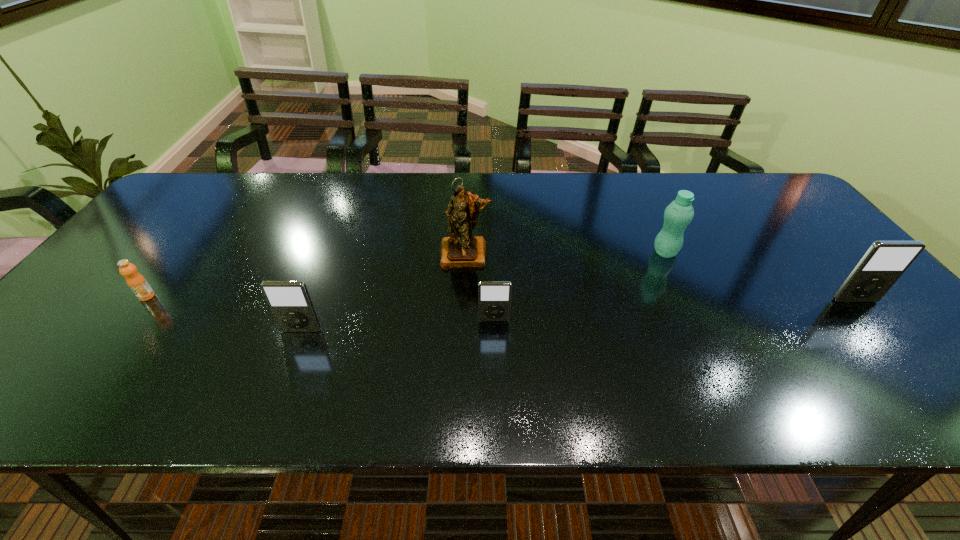
The height and width of the screenshot is (540, 960). In the image, there is a desktop. Find the location of `free space at the right edge`. free space at the right edge is located at coordinates (826, 273).

This screenshot has height=540, width=960. Find the location of `vacant area at the far right corner of the desktop`. vacant area at the far right corner of the desktop is located at coordinates (772, 199).

Image resolution: width=960 pixels, height=540 pixels. I want to click on empty space between the rightmost object and the fourth tallest object, so click(x=578, y=315).

The width and height of the screenshot is (960, 540). I want to click on empty space that is in between the nearest object and the rightmost iPod, so click(x=578, y=315).

Locate an element on the screen. Image resolution: width=960 pixels, height=540 pixels. empty location between the fifth object from right to left and the orange juice is located at coordinates (224, 314).

I want to click on vacant space in between the third shortest object and the rightmost iPod, so click(x=578, y=315).

Locate an element on the screen. free space between the shortest iPod and the second tallest iPod is located at coordinates (397, 325).

This screenshot has width=960, height=540. What are the coordinates of `empty space that is in between the second farthest iPod and the nearest object` in the screenshot? It's located at (397, 325).

You are a GUI agent. You are given a task and a screenshot of the screen. Output one action in this format:
    pyautogui.click(x=<x>, y=<y>)
    Task: Click on the empty space between the fourth tallest object and the tallest iPod
    
    Given the screenshot: What is the action you would take?
    pyautogui.click(x=578, y=315)

At what (x,y) coordinates should I click in order to perform the action: click on unoccupied area between the second object from right to left and the orange juice. Please return your answer as a coordinate pair (x, y). The image size is (960, 540). Looking at the image, I should click on (406, 274).